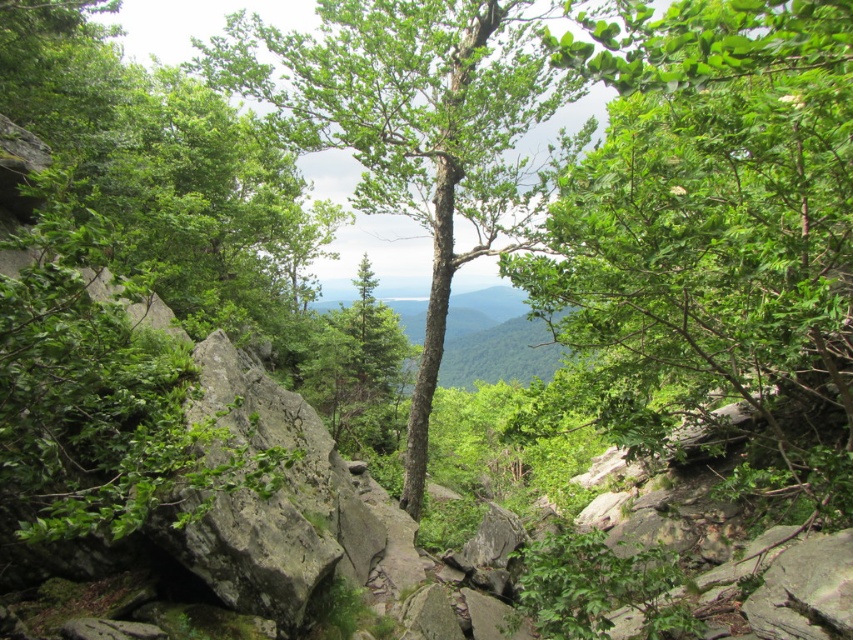
Can you confirm if green leafy tree at center is positioned to the right of green rough bark tree at center?

Correct, you'll find green leafy tree at center to the right of green rough bark tree at center.

Who is shorter, green leafy tree at center or green rough bark tree at center?

With less height is green leafy tree at center.

Is point (805, 432) more distant than point (395, 179)?

No, (805, 432) is closer to viewer.

Identify the location of green leafy tree at center. This screenshot has width=853, height=640. (717, 230).